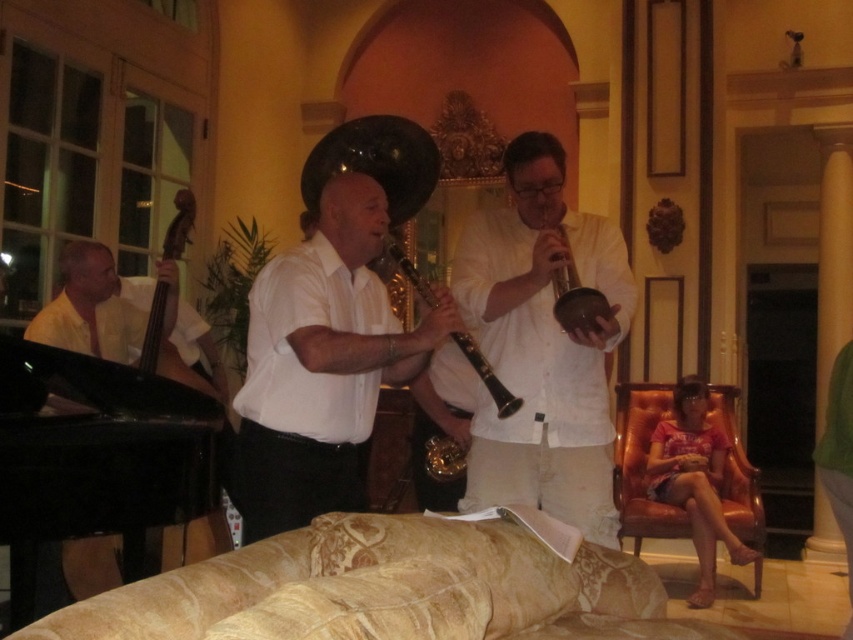
Consider the image. You are a stagehand setting up a music stand for the black polished wood upright bass at left and the metallic gold trumpet at center. Which instrument requires a larger music stand?

The black polished wood upright bass at left requires a larger music stand because it is bigger than the metallic gold trumpet at center.

In the scene shown: You are a photographer positioned at the entrance of the room. You want to take a photo that includes both the black polished wood upright bass at left and the metallic gold trumpet at center. Which object should you place closer to the left edge of your camera frame to ensure both are visible?

You should place the black polished wood upright wood upright bass at left closer to the left edge of your camera frame because it is positioned to the left of the metallic gold trumpet at center in the scene.

You are a stagehand setting up a narrow corridor between the black polished wood upright bass at left and the matte black hautboy at lower right. The corridor must be at least 1.2 meters wide to allow performers to pass. Based on the scene description, can you confirm if the corridor will be wide enough?

The black polished wood upright bass at left might be wider than matte black hautboy at lower right, so the corridor between them may not be wide enough for performers to pass if the bass is wider than 1.2 meters. However, without exact measurements, it is uncertain.